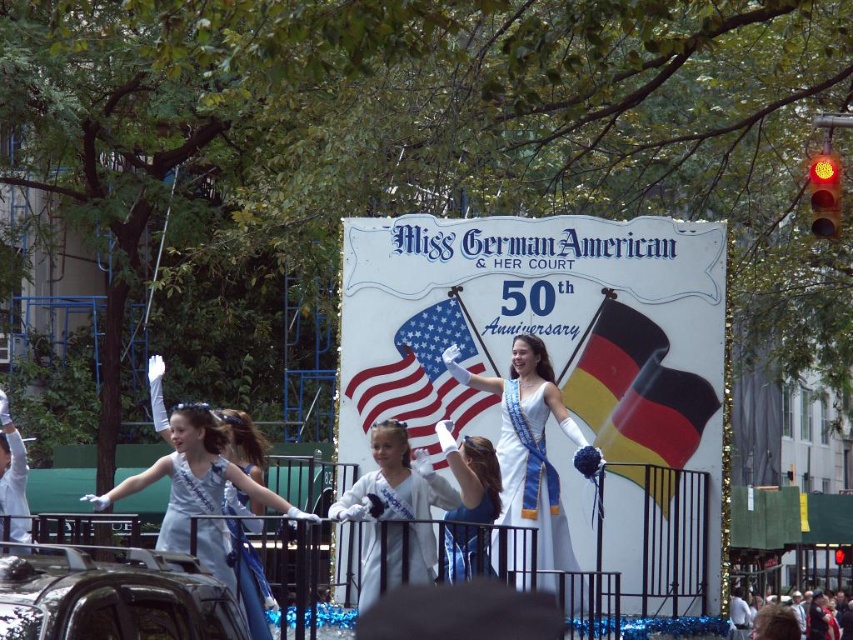
Can you confirm if yellow-black-red fabric flag at center is bigger than white cotton shirt at lower right?

No, yellow-black-red fabric flag at center is not bigger than white cotton shirt at lower right.

Is yellow-black-red fabric flag at center smaller than white cotton shirt at lower right?

Correct, yellow-black-red fabric flag at center occupies less space than white cotton shirt at lower right.

Does point (699, 420) lie behind point (741, 627)?

No, it is in front of (741, 627).

Identify the location of yellow-black-red fabric flag at center. (637, 397).

Is point (637, 352) positioned in front of point (543, 468)?

No.

Who is more forward, (685, 417) or (521, 513)?

Positioned in front is point (521, 513).

Locate an element on the screen. yellow-black-red fabric flag at center is located at coordinates (637, 397).

Is yellow-black-red fabric flag at center above american flag at center?

Correct, yellow-black-red fabric flag at center is located above american flag at center.

Which is more to the left, yellow-black-red fabric flag at center or american flag at center?

american flag at center is more to the left.

Between point (581, 403) and point (350, 392), which one is positioned behind?

The point (350, 392) is more distant.

Where is `yellow-black-red fabric flag at center`? The height and width of the screenshot is (640, 853). yellow-black-red fabric flag at center is located at coordinates (637, 397).